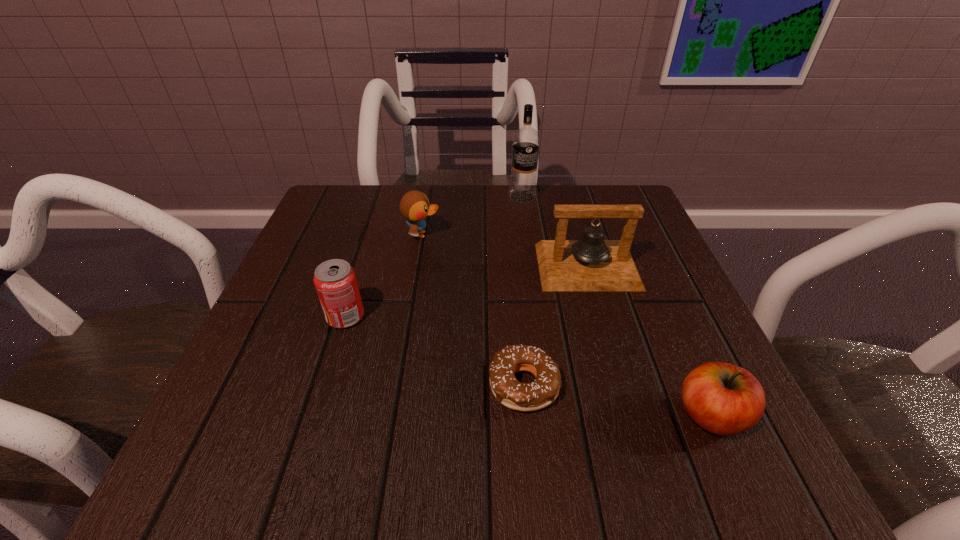
Locate an element on the screen. This screenshot has height=540, width=960. free space at the near left corner of the desktop is located at coordinates (209, 450).

Identify the location of vacant space at the far right corner of the desktop. The image size is (960, 540). (648, 234).

The height and width of the screenshot is (540, 960). Identify the location of free area in between the fourth nearest object and the apple. (649, 341).

Identify the location of unoccupied position between the apple and the bell. The width and height of the screenshot is (960, 540). (649, 341).

Identify the location of free space between the duck and the farthest object. This screenshot has width=960, height=540. (472, 215).

Locate an element on the screen. Image resolution: width=960 pixels, height=540 pixels. free spot between the bell and the apple is located at coordinates (649, 341).

Where is `vacant area that lies between the bell and the shortest object`? The image size is (960, 540). vacant area that lies between the bell and the shortest object is located at coordinates (556, 326).

This screenshot has height=540, width=960. Identify the location of empty location between the tallest object and the third farthest object. (555, 232).

Identify the location of free spot between the apple and the bell. (649, 341).

I want to click on free spot between the tallest object and the second object from left to right, so click(472, 215).